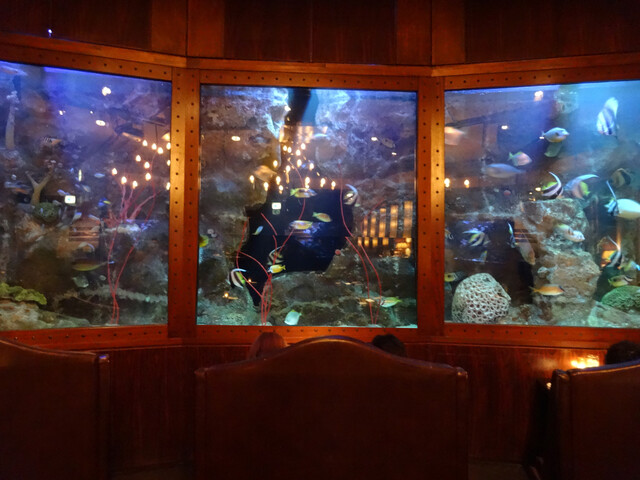
In order to click on window 3 in this screenshot , I will do `click(550, 73)`.